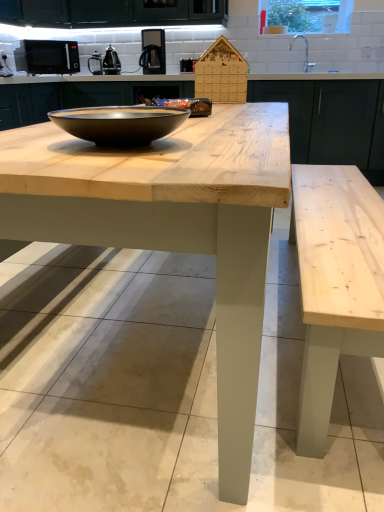
Question: Is point (306, 15) closer or farther from the camera than point (162, 59)?

Choices:
 (A) closer
 (B) farther

Answer: (A)

Question: Would you say transparent glass window screen at upper right is inside or outside satin black coffee machine at upper center?

Choices:
 (A) inside
 (B) outside

Answer: (B)

Question: Estimate the real-world distances between objects in this image. Which object is farther from the natural wood cabinetry at center?

Choices:
 (A) transparent glass window screen at upper right
 (B) matte black bowl at center
 (C) satin black coffee machine at upper center
 (D) black matte microwave at upper left, the second appliance in the right-to-left sequence
 (E) natural wood table at center

Answer: (B)

Question: Which of these objects is positioned farthest from the natural wood table at center?

Choices:
 (A) matte black bowl at center
 (B) transparent glass window screen at upper right
 (C) natural wood cabinetry at center
 (D) black matte microwave at upper left, placed as the 1th appliance when sorted from left to right
 (E) satin black coffee machine at upper center

Answer: (D)